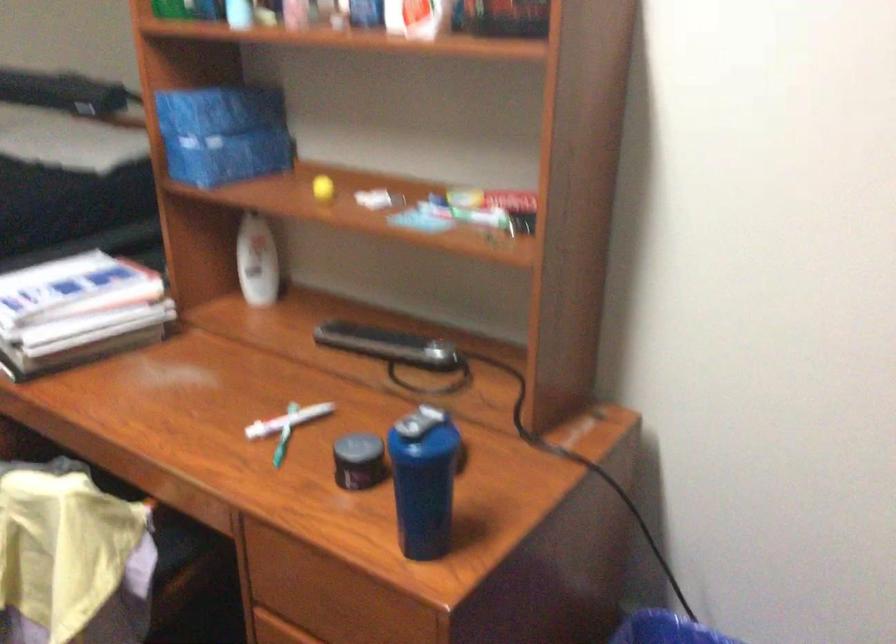
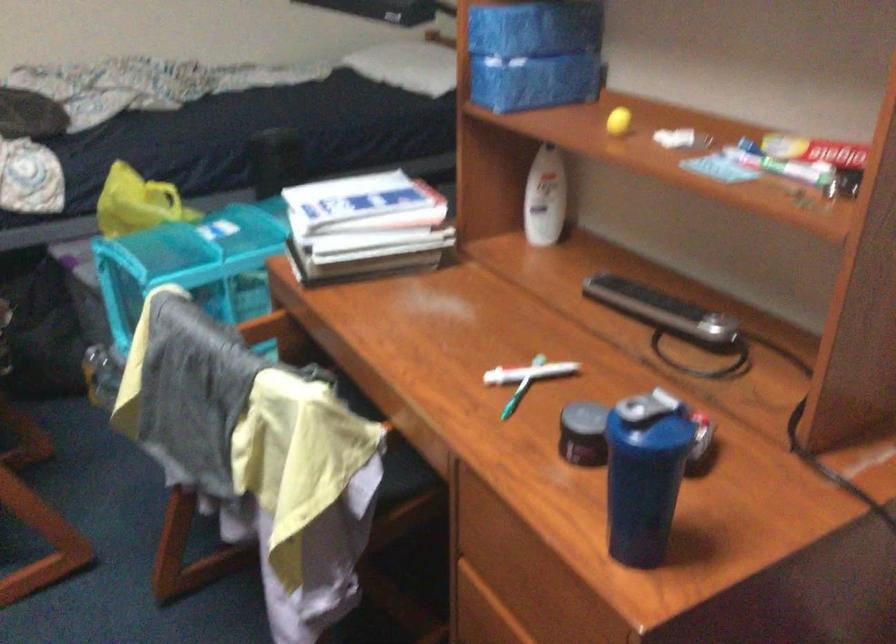
In the second image, find the point that corresponds to pixel 228 105 in the first image.

(536, 26)